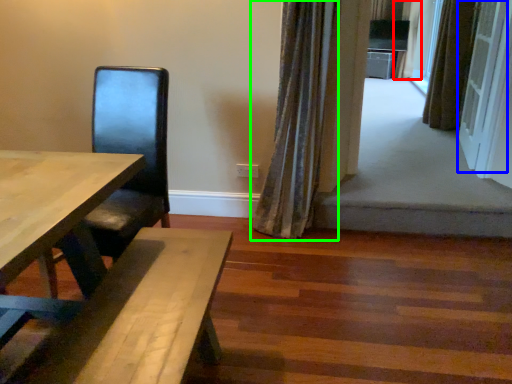
Question: Which object is the closest to the curtain (highlighted by a red box)? Choose among these: screen door (highlighted by a blue box) or curtain (highlighted by a green box).

Choices:
 (A) screen door
 (B) curtain

Answer: (A)